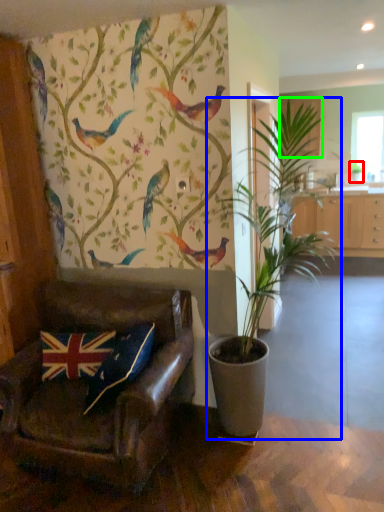
Question: Estimate the real-world distances between objects in this image. Which object is farther from houseplant (highlighted by a red box), houseplant (highlighted by a blue box) or cabinetry (highlighted by a green box)?

Choices:
 (A) houseplant
 (B) cabinetry

Answer: (A)